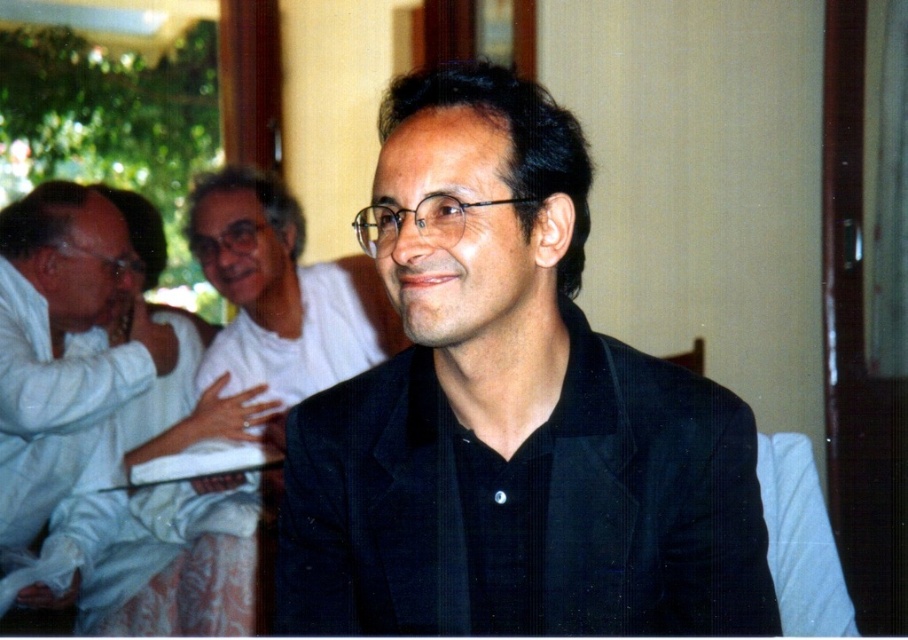
Question: Does black textured suit at center have a greater width compared to white cotton shirt at left?

Choices:
 (A) yes
 (B) no

Answer: (B)

Question: Is black textured suit at center smaller than white cotton shirt at left?

Choices:
 (A) no
 (B) yes

Answer: (B)

Question: Does black textured suit at center appear on the right side of white cotton shirt at left?

Choices:
 (A) yes
 (B) no

Answer: (A)

Question: Which point is closer to the camera?

Choices:
 (A) black textured suit at center
 (B) white cotton shirt at left

Answer: (A)